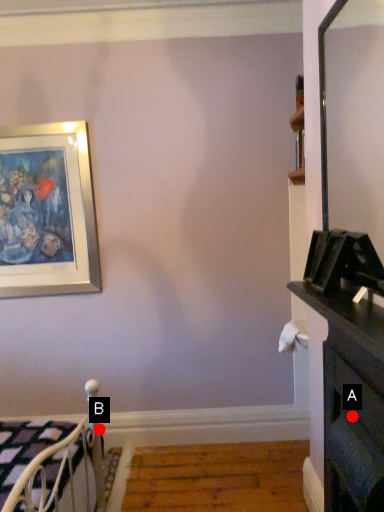
Question: Two points are circled on the image, labeled by A and B beside each circle. Which of the following is the closest to the observer?

Choices:
 (A) A is closer
 (B) B is closer

Answer: (A)